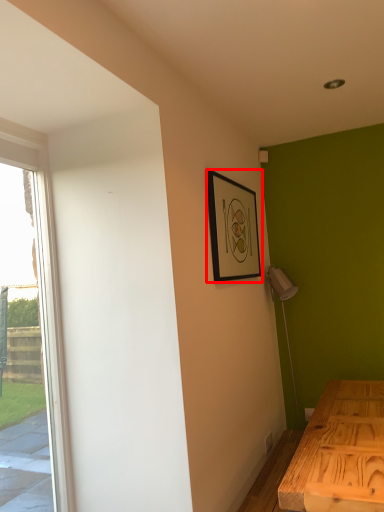
Question: From the image's perspective, considering the relative positions of picture frame (annotated by the red box) and window in the image provided, where is picture frame (annotated by the red box) located with respect to the staircase?

Choices:
 (A) below
 (B) above

Answer: (B)